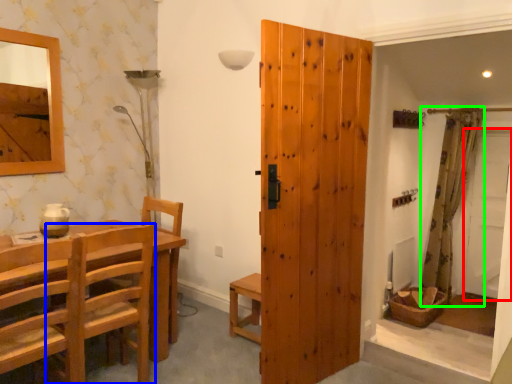
Question: Which object is the farthest from screen door (highlighted by a red box)? Choose among these: chair (highlighted by a blue box) or curtain (highlighted by a green box).

Choices:
 (A) chair
 (B) curtain

Answer: (A)